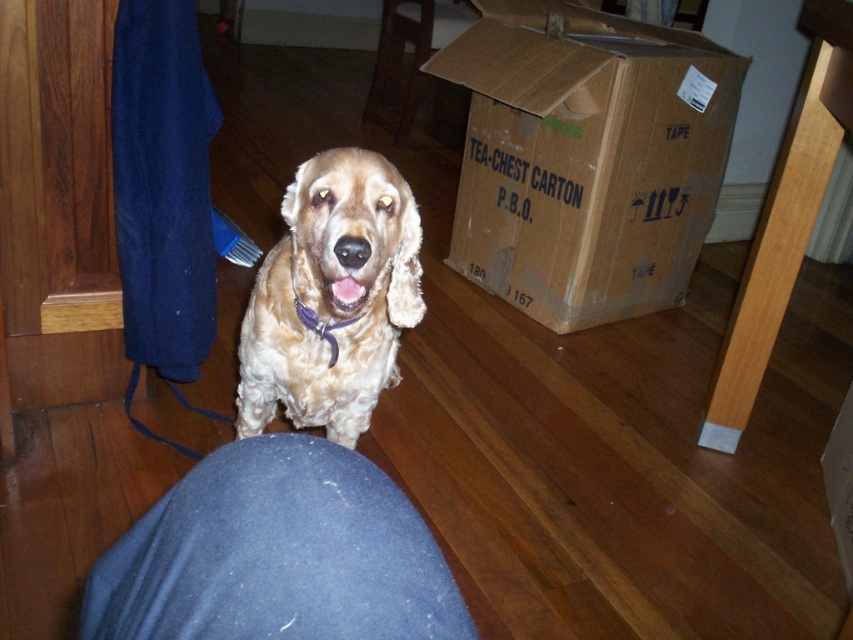
Question: Where is golden fur dog at center located in relation to purple fabric neckband at center in the image?

Choices:
 (A) above
 (B) below

Answer: (B)

Question: Which of these objects is positioned farthest from the denim at lower center?

Choices:
 (A) golden fur dog at center
 (B) cardboard box at upper center
 (C) purple fabric neckband at center

Answer: (B)

Question: Estimate the real-world distances between objects in this image. Which object is closer to the cardboard box at upper center?

Choices:
 (A) golden fur dog at center
 (B) brown cardboard box at center

Answer: (B)

Question: Estimate the real-world distances between objects in this image. Which object is closer to the purple fabric neckband at center?

Choices:
 (A) cardboard box at upper center
 (B) brown cardboard box at center
 (C) golden fur dog at center

Answer: (C)

Question: In this image, where is brown cardboard box at center located relative to golden fur dog at center?

Choices:
 (A) right
 (B) left

Answer: (A)

Question: Does golden fur dog at center appear on the right side of purple fabric neckband at center?

Choices:
 (A) no
 (B) yes

Answer: (A)